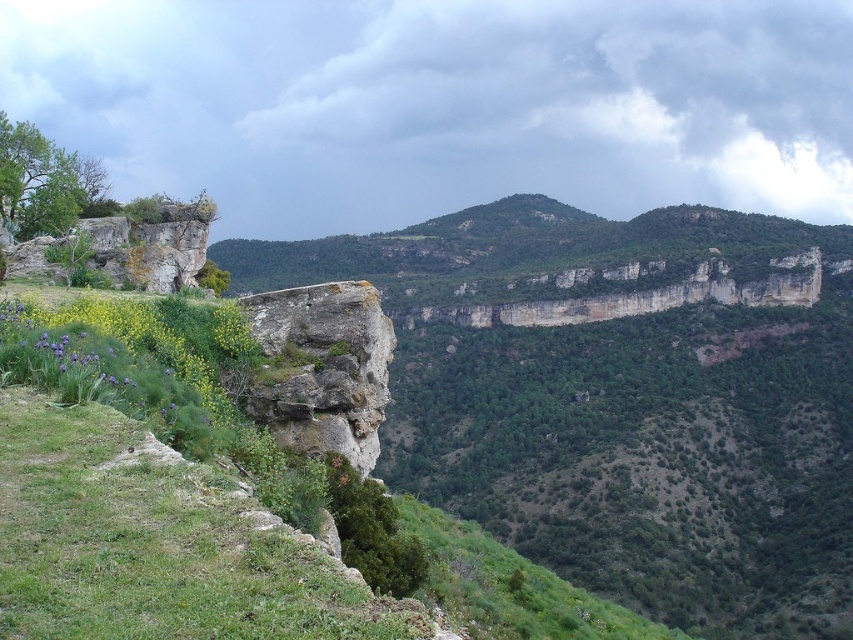
Is point (24, 544) positioned after point (343, 346)?

That is False.

Looking at this image, does green grassy at lower left have a larger size compared to rusty stone cliff at center?

Indeed, green grassy at lower left has a larger size compared to rusty stone cliff at center.

Between point (61, 540) and point (271, 337), which one is positioned in front?

Point (61, 540)

Find the location of a particular element. Image resolution: width=853 pixels, height=640 pixels. green grassy at lower left is located at coordinates (157, 541).